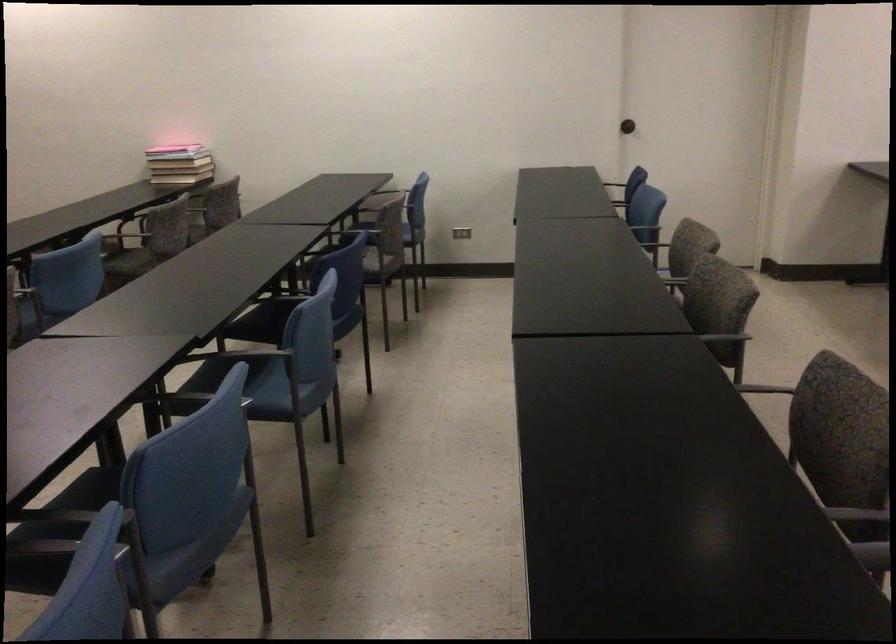
The image size is (896, 644). What do you see at coordinates (461, 232) in the screenshot? I see `a wall light switch` at bounding box center [461, 232].